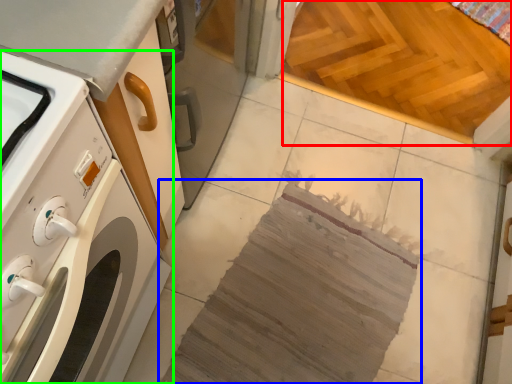
Question: Which object is positioned closest to plywood (highlighted by a red box)? Select from blanket (highlighted by a blue box) and home appliance (highlighted by a green box).

Choices:
 (A) blanket
 (B) home appliance

Answer: (A)